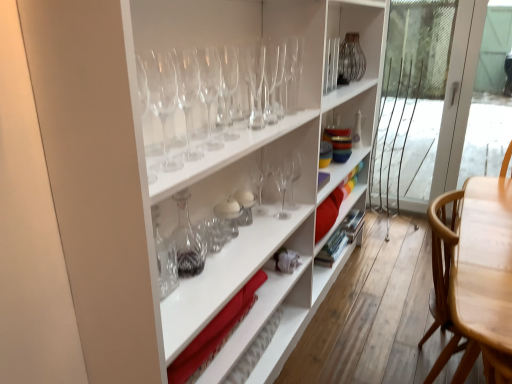
Find the location of `free region on the left part of light brown wood chair at right`. free region on the left part of light brown wood chair at right is located at coordinates (355, 361).